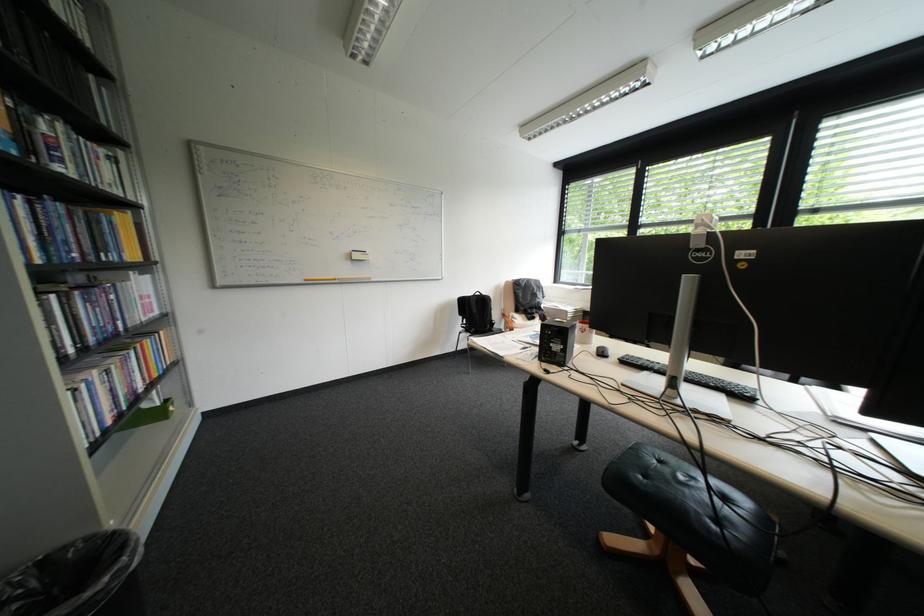
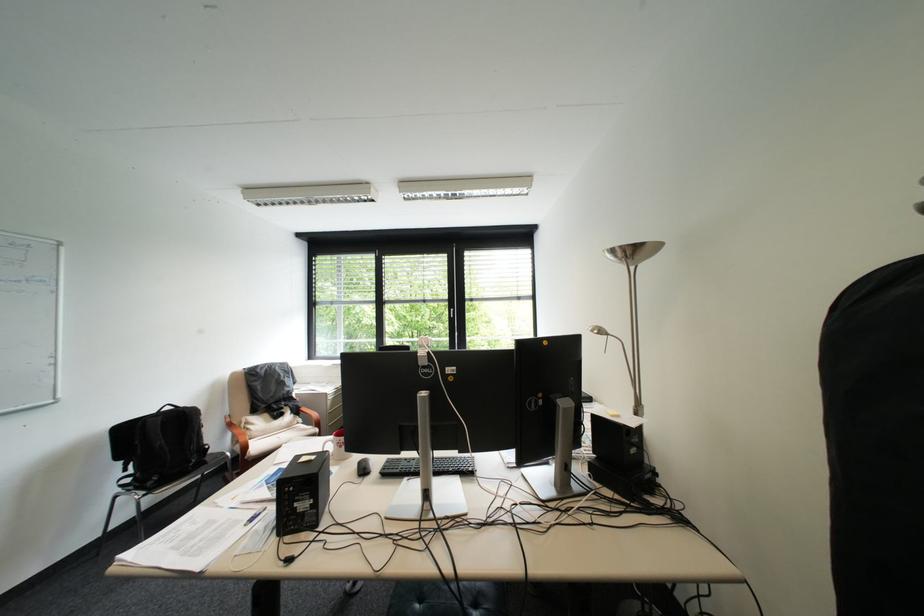
In the second image, find the point that corresponds to the point at 523,318 in the first image.

(256, 424)